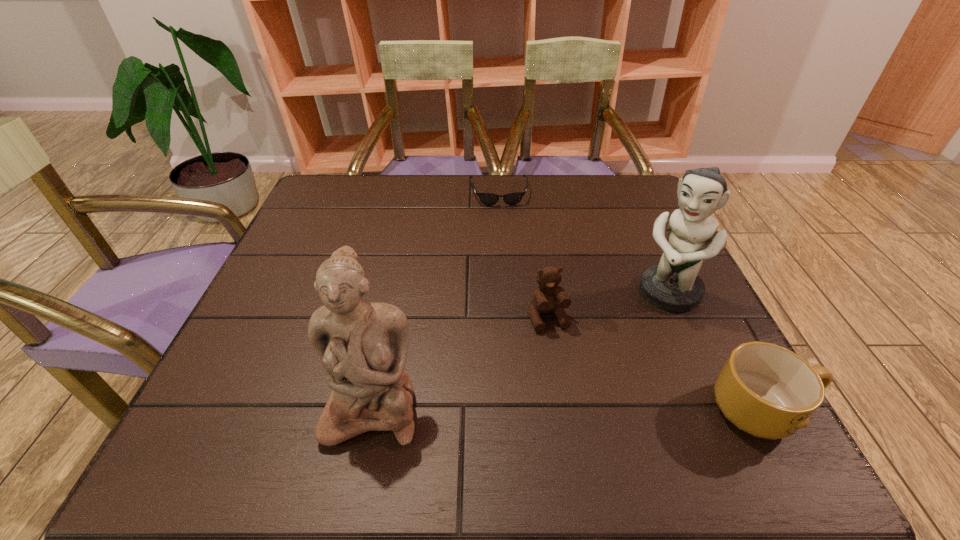
Where is `vacant space in between the fourth tallest object and the left figurine`? The image size is (960, 540). vacant space in between the fourth tallest object and the left figurine is located at coordinates (568, 408).

Identify the location of vacant area that lies between the right figurine and the teddy bear. click(608, 306).

The width and height of the screenshot is (960, 540). Identify the location of free space between the farthest object and the right figurine. (584, 242).

Where is `vacant region between the fourth tallest object and the nearer figurine`? The image size is (960, 540). vacant region between the fourth tallest object and the nearer figurine is located at coordinates (568, 408).

You are a GUI agent. You are given a task and a screenshot of the screen. Output one action in this format:
    pyautogui.click(x=<x>, y=<y>)
    Task: Click on the free spot between the second shortest object and the teddy bear
    This screenshot has height=540, width=960.
    Given the screenshot: What is the action you would take?
    pyautogui.click(x=656, y=364)

Where is `vacant space in between the shortest object and the nearer figurine`? This screenshot has width=960, height=540. vacant space in between the shortest object and the nearer figurine is located at coordinates (436, 299).

Image resolution: width=960 pixels, height=540 pixels. Identify the location of vacant area that lies between the right figurine and the mug. (715, 352).

At what (x,y) coordinates should I click in order to perform the action: click on vacant region between the shortest object and the right figurine. Please return your answer as a coordinate pair (x, y). The height and width of the screenshot is (540, 960). Looking at the image, I should click on (584, 242).

The image size is (960, 540). Find the location of `vacant area that lies between the sunglasses and the teddy bear`. vacant area that lies between the sunglasses and the teddy bear is located at coordinates (523, 255).

Select which object appears as the closest to the left figurine. Please provide its 2D coordinates. Your answer should be formatted as a tuple, i.e. [(x, y)], where the tuple contains the x and y coordinates of a point satisfying the conditions above.

[(549, 297)]